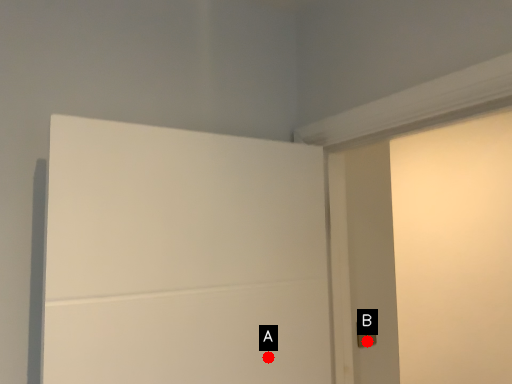
Question: Two points are circled on the image, labeled by A and B beside each circle. Which point is closer to the camera?

Choices:
 (A) A is closer
 (B) B is closer

Answer: (A)